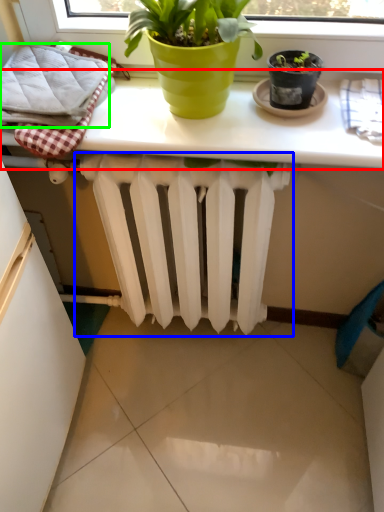
Question: Which object is the farthest from table (highlighted by a red box)? Choose among these: radiator (highlighted by a blue box) or bath towel (highlighted by a green box).

Choices:
 (A) radiator
 (B) bath towel

Answer: (A)